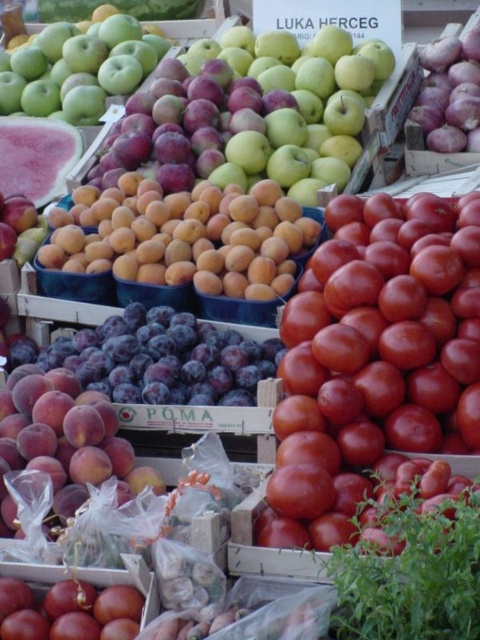
Question: Does glossy red tomato at center appear on the left side of shiny peach at center?

Choices:
 (A) yes
 (B) no

Answer: (B)

Question: Which is nearer to the purple matte onion at upper right?

Choices:
 (A) glossy red tomato at center
 (B) shiny peach at center
 (C) glossy red tomato at lower left

Answer: (A)

Question: Which object is the farthest from the shiny peach at center?

Choices:
 (A) purple matte onion at upper right
 (B) glossy red tomato at lower left
 (C) glossy red tomato at center

Answer: (A)

Question: Where is glossy red tomato at center located in relation to glossy red tomato at lower left in the image?

Choices:
 (A) left
 (B) right

Answer: (B)

Question: Which of the following is the farthest from the observer?

Choices:
 (A) (49, 616)
 (B) (74, 467)
 (C) (478, 58)
 (D) (340, 339)

Answer: (C)

Question: Is glossy red tomato at center to the right of purple matte onion at upper right from the viewer's perspective?

Choices:
 (A) no
 (B) yes

Answer: (A)